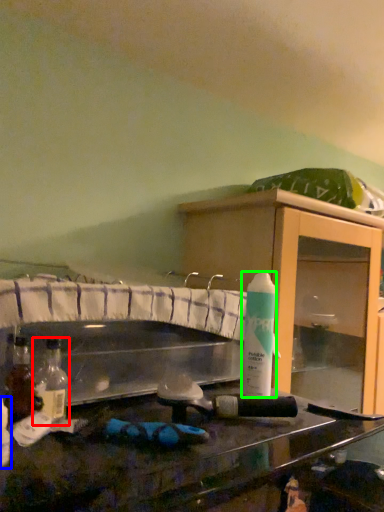
Question: Estimate the real-world distances between objects in this image. Which object is farther from bottle (highlighted by a red box), bottle (highlighted by a blue box) or cleaning product (highlighted by a green box)?

Choices:
 (A) bottle
 (B) cleaning product

Answer: (B)